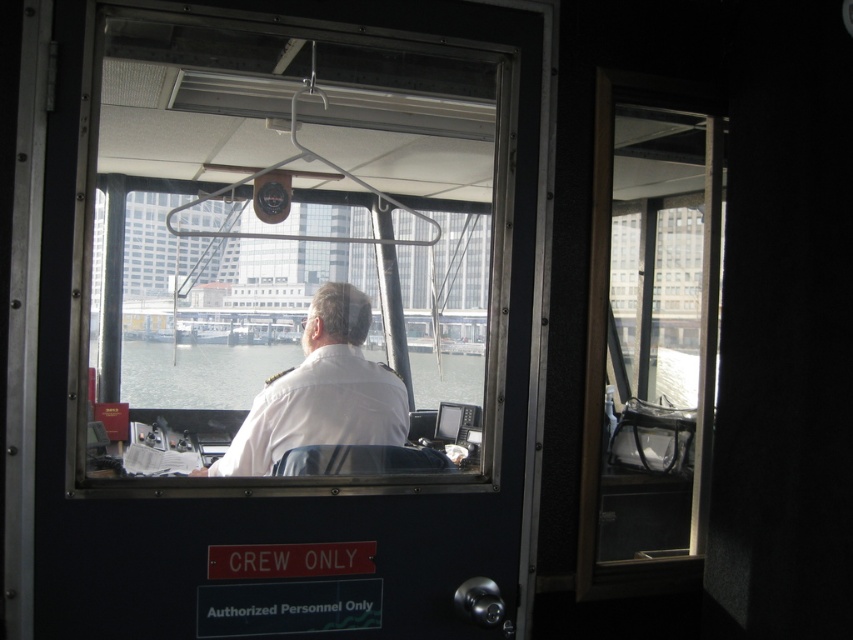
Which of these two, transparent glass window at upper right or clear water at center, stands shorter?

With less height is clear water at center.

Is point (689, 540) more distant than point (234, 349)?

No, (689, 540) is in front of (234, 349).

Locate an element on the screen. This screenshot has width=853, height=640. transparent glass window at upper right is located at coordinates (653, 332).

Locate an element on the screen. transparent glass window at upper right is located at coordinates (653, 332).

Does white uniform at center have a smaller size compared to clear water at center?

Incorrect, white uniform at center is not smaller in size than clear water at center.

At what (x,y) coordinates should I click in order to perform the action: click on white uniform at center. Please return your answer as a coordinate pair (x, y). The width and height of the screenshot is (853, 640). Looking at the image, I should click on (321, 392).

Locate an element on the screen. The height and width of the screenshot is (640, 853). white uniform at center is located at coordinates point(321,392).

Can you confirm if transparent glass window at upper right is positioned to the right of white uniform at center?

Yes, transparent glass window at upper right is to the right of white uniform at center.

Find the location of a particular element. This screenshot has height=640, width=853. transparent glass window at upper right is located at coordinates (653, 332).

Locate an element on the screen. The image size is (853, 640). transparent glass window at upper right is located at coordinates (653, 332).

The height and width of the screenshot is (640, 853). In order to click on transparent glass window at upper right in this screenshot , I will do `click(653, 332)`.